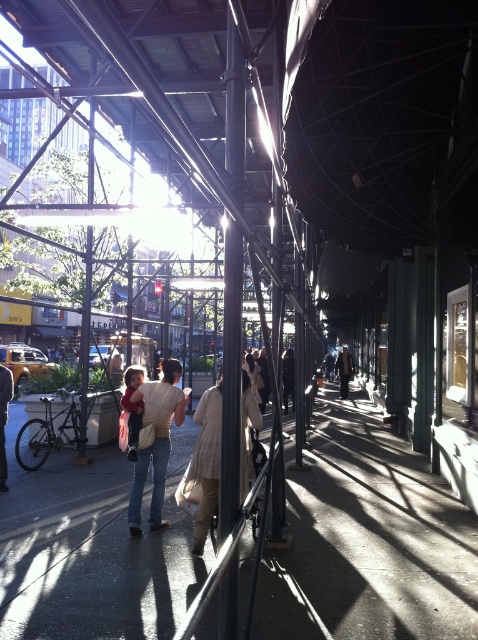
You are standing at the point marked by the coordinates point (206, 461) in the image. What object is located exactly at that point?

The point (206, 461) marks the beige textured coat at center.

You are a photographer trying to capture a candid shot of the beige textured coat at center and the denim jacket at center. Since you want to focus on the clothing details, which one should you zoom in on first to ensure it fits entirely within your camera frame?

The beige textured coat at center is shorter than the denim jacket at center, so you should zoom in on the beige textured coat at center first to ensure it fits entirely within your camera frame since it is smaller in height.

Consider the image. You are standing at the edge of the scene and want to walk towards the denim jacket at center. Which direction should you move relative to the concrete sidewalk at center?

To reach the denim jacket at center, you should move to the left of the concrete sidewalk at center since the concrete sidewalk at center is to the right of the denim jacket at center.